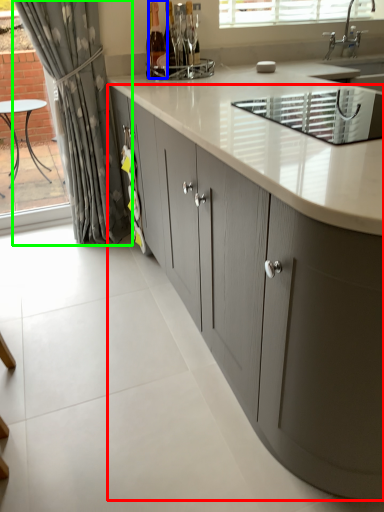
Question: Considering the real-world distances, which object is closest to cabinetry (highlighted by a red box)? bottle (highlighted by a blue box) or curtain (highlighted by a green box).

Choices:
 (A) bottle
 (B) curtain

Answer: (B)